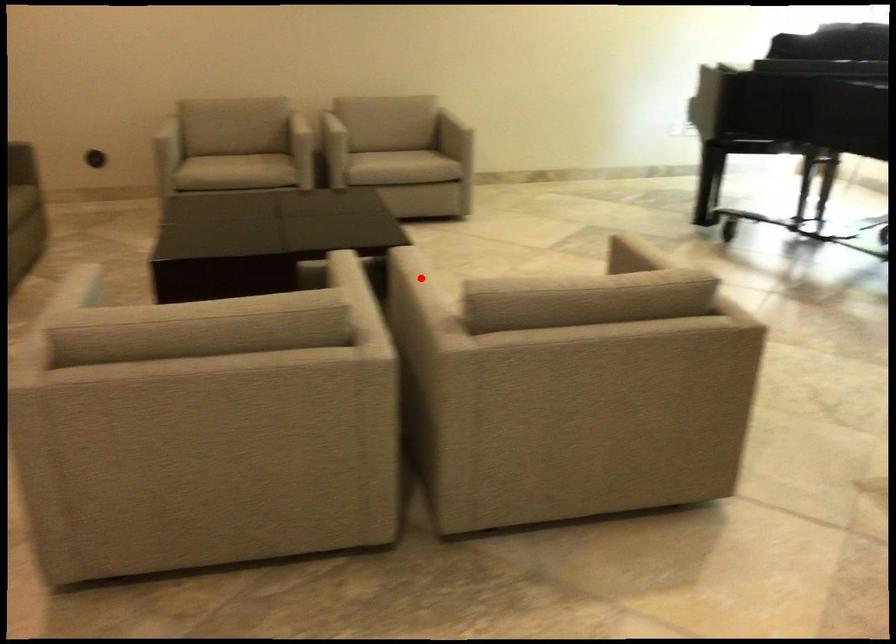
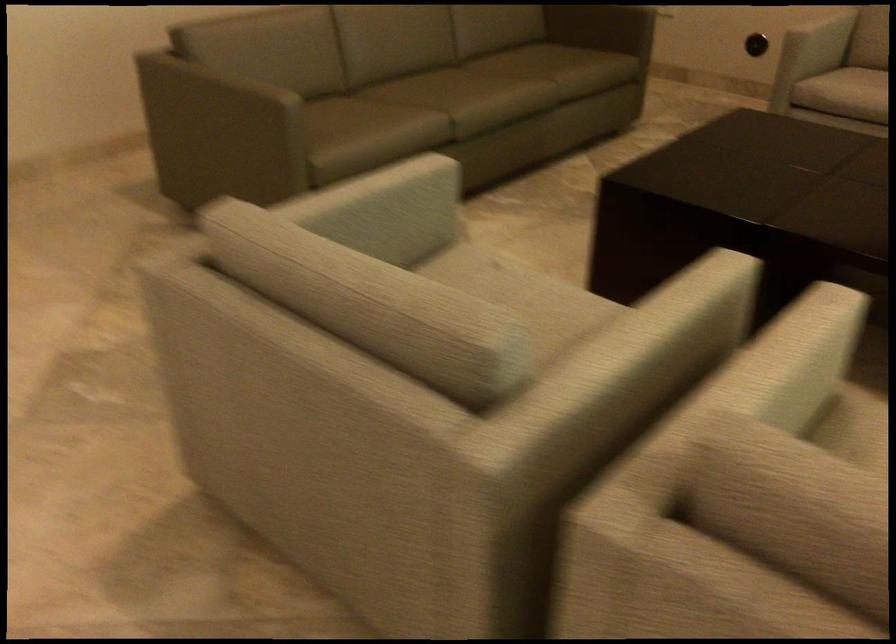
Question: I am providing you with two images of the same scene from different viewpoints. Given a red point in image1, look at the same physical point in image2. Is it:

Choices:
 (A) Closer to the viewpoint
 (B) Farther from the viewpoint

Answer: (A)